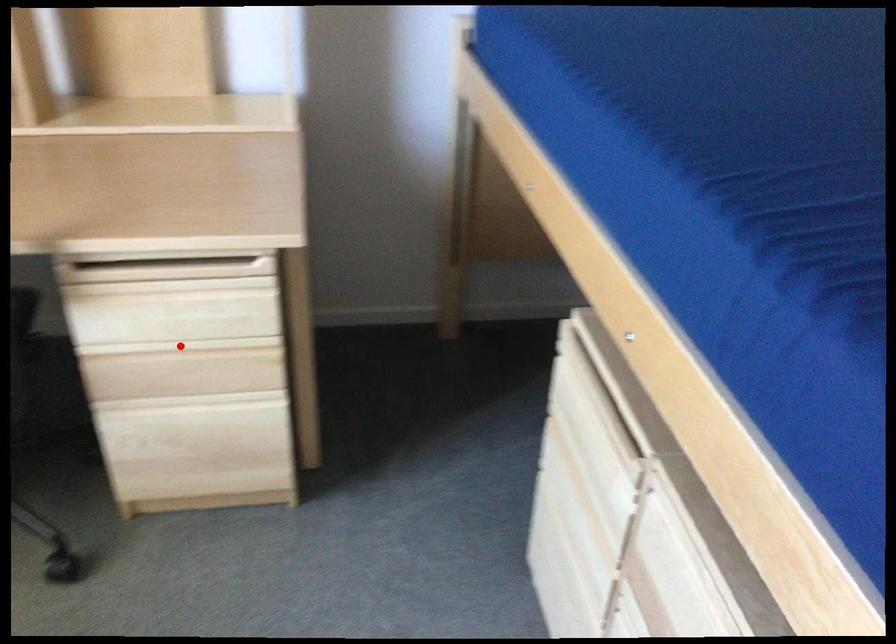
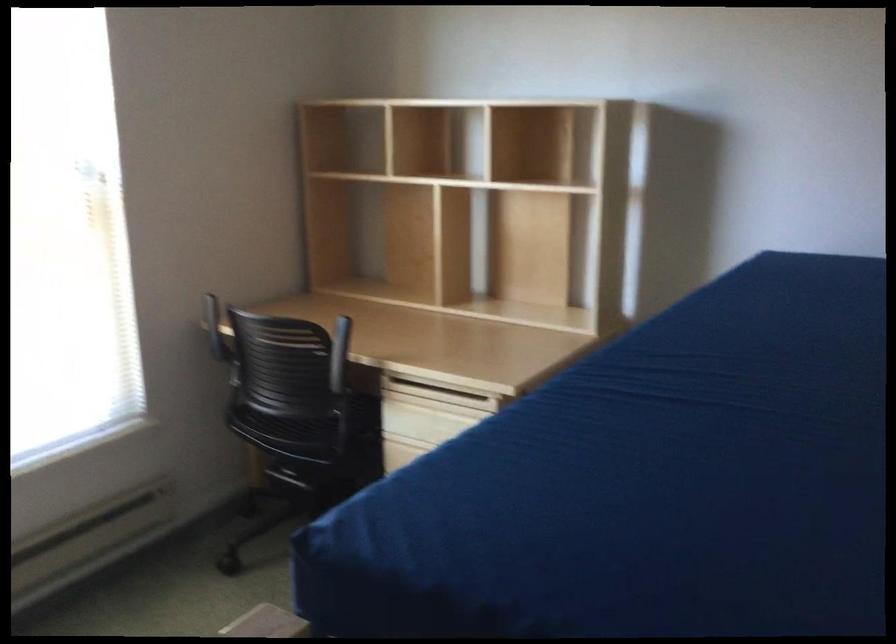
Question: I am providing you with two images of the same scene from different viewpoints. A red point is marked on the first image. Can you still see the location of the red point in image 2?

Choices:
 (A) Yes
 (B) No

Answer: (B)